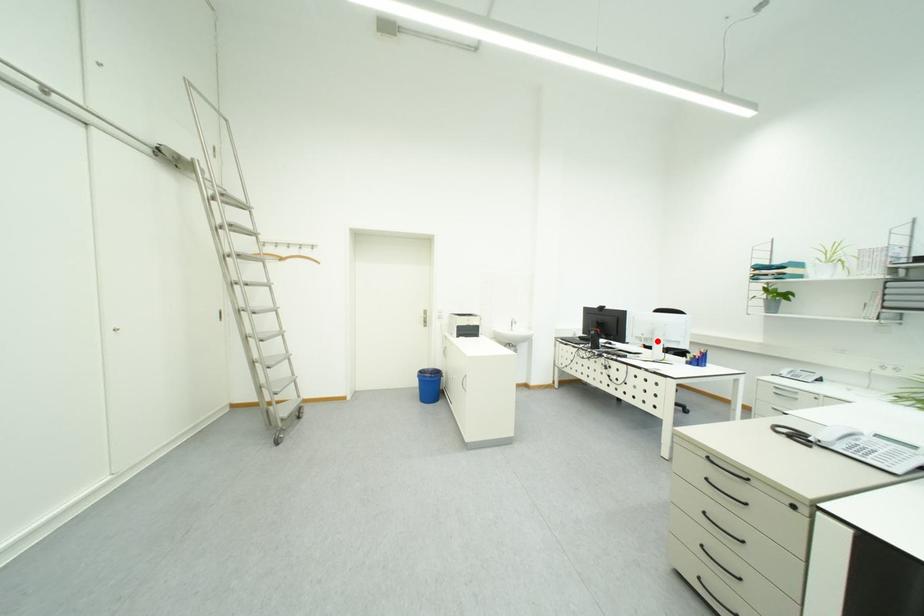
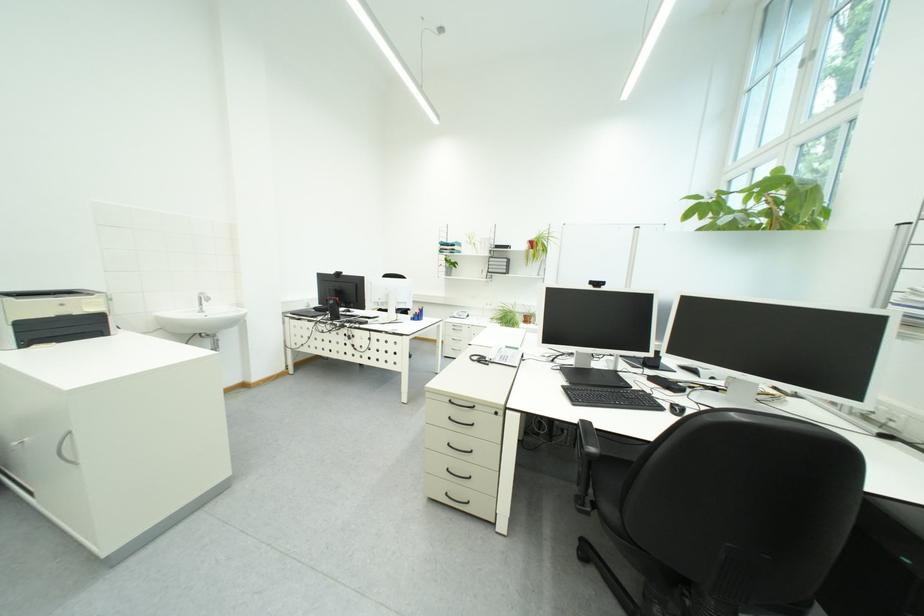
Question: I am providing you with two images of the same scene from different viewpoints. A red point is marked on the first image. Can you still see the location of the red point in image 2?

Choices:
 (A) Yes
 (B) No

Answer: (A)